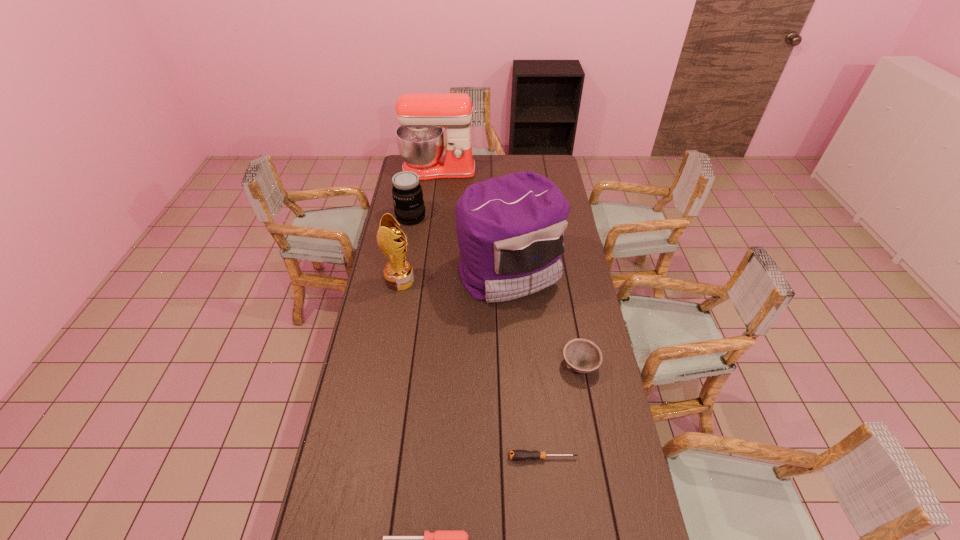
This screenshot has height=540, width=960. In order to click on free space located 0.370m on the front pocket of the backpack in this screenshot , I will do `click(517, 394)`.

Where is `free space located on the front-facing side of the fifth shortest object`? free space located on the front-facing side of the fifth shortest object is located at coordinates (446, 281).

At what (x,y) coordinates should I click in order to perform the action: click on free spot located 0.390m on the back of the second farthest object. Please return your answer as a coordinate pair (x, y). Image resolution: width=960 pixels, height=540 pixels. Looking at the image, I should click on (420, 167).

Image resolution: width=960 pixels, height=540 pixels. I want to click on free space located 0.370m on the back of the bowl, so click(x=564, y=279).

Find the location of a particular element. vacant space situated 0.160m on the back of the sixth farthest object is located at coordinates (538, 406).

The width and height of the screenshot is (960, 540). What are the coordinates of `object present at the far edge` in the screenshot? It's located at (420, 138).

Locate an element on the screen. The image size is (960, 540). mixer positioned at the left edge is located at coordinates (420, 138).

At what (x,y) coordinates should I click in order to perform the action: click on award located at the left edge. Please return your answer as a coordinate pair (x, y). This screenshot has height=540, width=960. Looking at the image, I should click on (398, 273).

Locate an element on the screen. Image resolution: width=960 pixels, height=540 pixels. telephoto lens located at the left edge is located at coordinates (407, 193).

The image size is (960, 540). I want to click on backpack that is at the right edge, so click(510, 230).